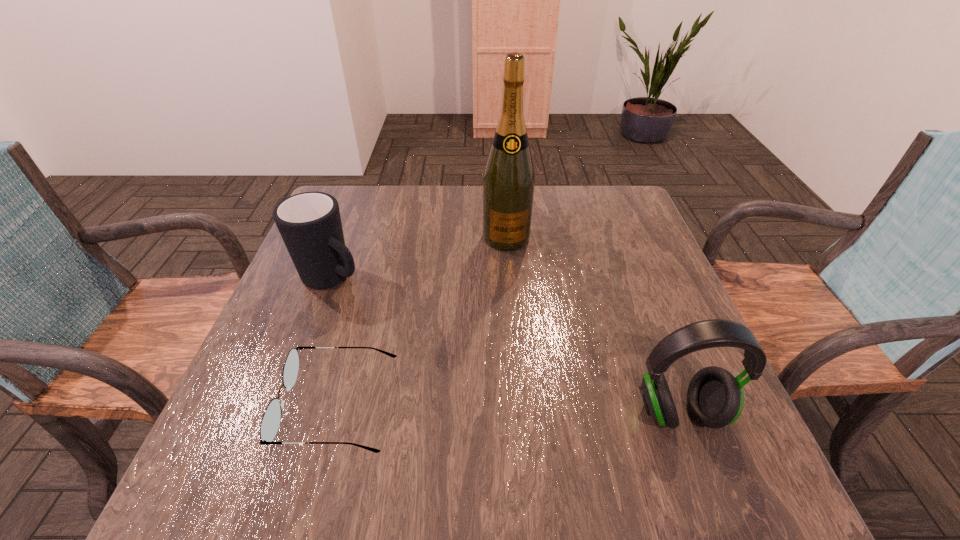
Where is `spectacles`? The width and height of the screenshot is (960, 540). spectacles is located at coordinates (270, 422).

Identify the location of headset. The width and height of the screenshot is (960, 540). (715, 398).

Find the location of a particular element. the third object from left to right is located at coordinates (508, 185).

The width and height of the screenshot is (960, 540). Find the location of `the tallest object`. the tallest object is located at coordinates (508, 185).

What are the coordinates of `the second farthest object` in the screenshot? It's located at (310, 225).

Image resolution: width=960 pixels, height=540 pixels. I want to click on vacant region located on the lenses of the spectacles, so click(x=252, y=405).

Where is `vacant space located on the front-facing side of the wine bottle`? This screenshot has height=540, width=960. vacant space located on the front-facing side of the wine bottle is located at coordinates (516, 325).

Identify the location of free region located 0.120m on the front-facing side of the wine bottle. (512, 284).

Locate an element on the screen. free point located on the front-facing side of the wine bottle is located at coordinates (514, 302).

I want to click on vacant space located on the side of the mug with the handle, so click(453, 356).